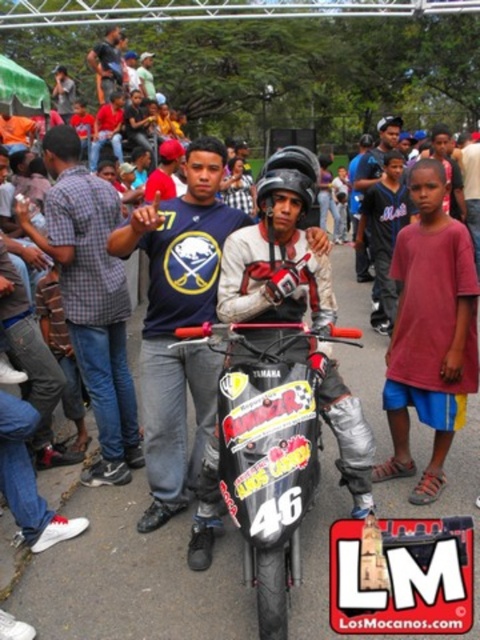
Question: Which object is farther from the camera taking this photo?

Choices:
 (A) shiny metallic motorcycle at center
 (B) matte black helmet at center

Answer: (B)

Question: Is matte blue shirt at center wider than black matte helmet at center?

Choices:
 (A) no
 (B) yes

Answer: (A)

Question: Can you confirm if black matte helmet at center is positioned below matte black helmet at center?

Choices:
 (A) yes
 (B) no

Answer: (B)

Question: Which object appears closest to the camera in this image?

Choices:
 (A) matte blue jersey at center
 (B) maroon cotton shirt at center
 (C) shiny metallic motorcycle at center
 (D) black matte helmet at center

Answer: (C)

Question: Considering the real-world distances, which object is closest to the matte blue shirt at center?

Choices:
 (A) black matte helmet at center
 (B) dark blue jersey at center
 (C) shiny metallic motorcycle at center

Answer: (C)

Question: Considering the relative positions of matte blue jersey at center and maroon cotton shirt at center in the image provided, where is matte blue jersey at center located with respect to maroon cotton shirt at center?

Choices:
 (A) above
 (B) below

Answer: (B)